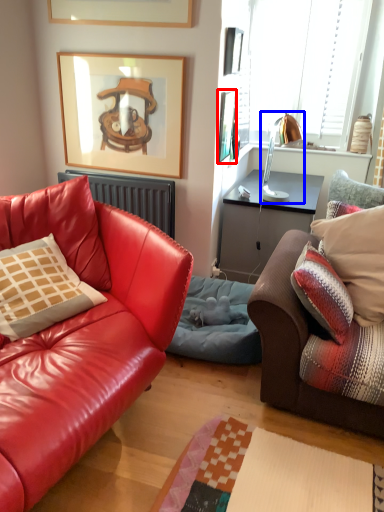
Question: Which of the following is the farthest to the observer, picture frame (highlighted by a red box) or lamp (highlighted by a blue box)?

Choices:
 (A) picture frame
 (B) lamp

Answer: (B)